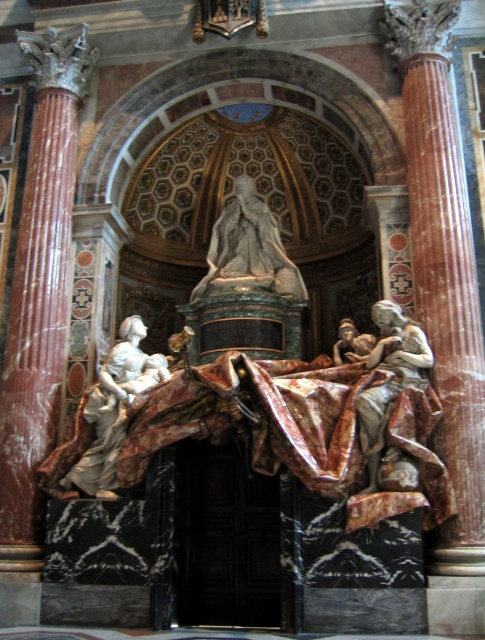
Question: Can you confirm if marble column at left is smaller than marble statue at center?

Choices:
 (A) yes
 (B) no

Answer: (B)

Question: Is marble statue of woman holding child at left bigger than marble statue at center?

Choices:
 (A) no
 (B) yes

Answer: (A)

Question: Which object is the farthest from the marble column at left?

Choices:
 (A) marble statue at center
 (B) marble statue of woman holding child at left

Answer: (A)

Question: Among these objects, which one is farthest from the camera?

Choices:
 (A) marble statue at center
 (B) marble column at left
 (C) marble statue of woman holding child at left

Answer: (A)

Question: Is marble statue of woman holding child at left to the left of marble statue at center from the viewer's perspective?

Choices:
 (A) yes
 (B) no

Answer: (A)

Question: Which of the following is the farthest from the observer?

Choices:
 (A) marble statue of woman holding child at left
 (B) marble statue at center

Answer: (B)